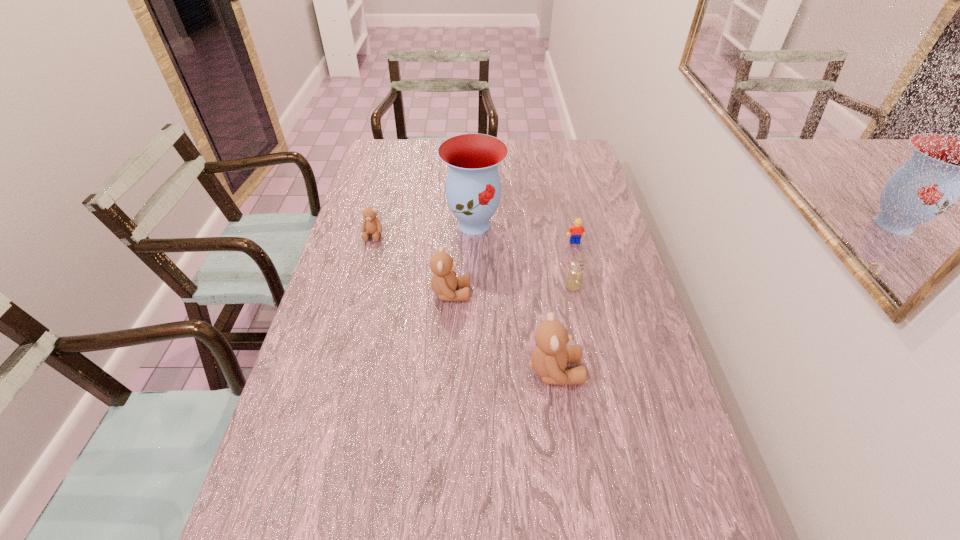
Image resolution: width=960 pixels, height=540 pixels. I want to click on vacant region located on the front-facing side of the second nearest teddy bear, so click(533, 293).

Where is `free spot located 0.200m on the front-facing side of the rightmost teddy bear`? The width and height of the screenshot is (960, 540). free spot located 0.200m on the front-facing side of the rightmost teddy bear is located at coordinates (662, 371).

The image size is (960, 540). I want to click on vacant space situated on the face of the Lego, so click(594, 324).

The height and width of the screenshot is (540, 960). I want to click on vacant space located on the front of the vase, so click(473, 287).

The height and width of the screenshot is (540, 960). Find the location of `free region located on the back of the saltshaker`. free region located on the back of the saltshaker is located at coordinates (560, 224).

At what (x,y) coordinates should I click in order to perform the action: click on object at the left edge. Please return your answer as a coordinate pair (x, y). The height and width of the screenshot is (540, 960). Looking at the image, I should click on (371, 225).

Find the location of a particular element. This screenshot has height=540, width=960. Lego at the right edge is located at coordinates (577, 230).

Identify the location of saltshaker located in the right edge section of the desktop. The height and width of the screenshot is (540, 960). (573, 282).

Identify the location of vacant space at the left edge of the desktop. (383, 215).

I want to click on vacant space at the right edge of the desktop, so click(655, 350).